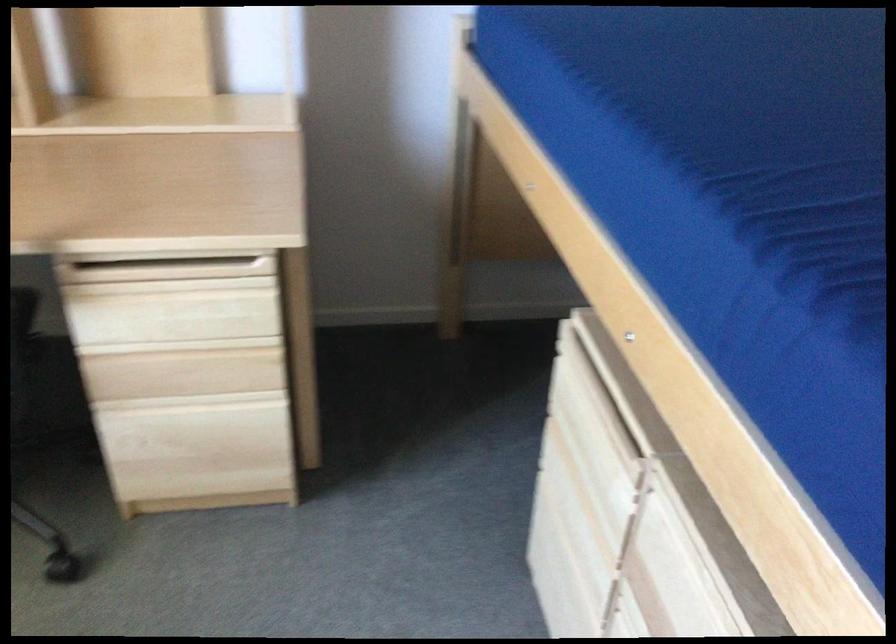
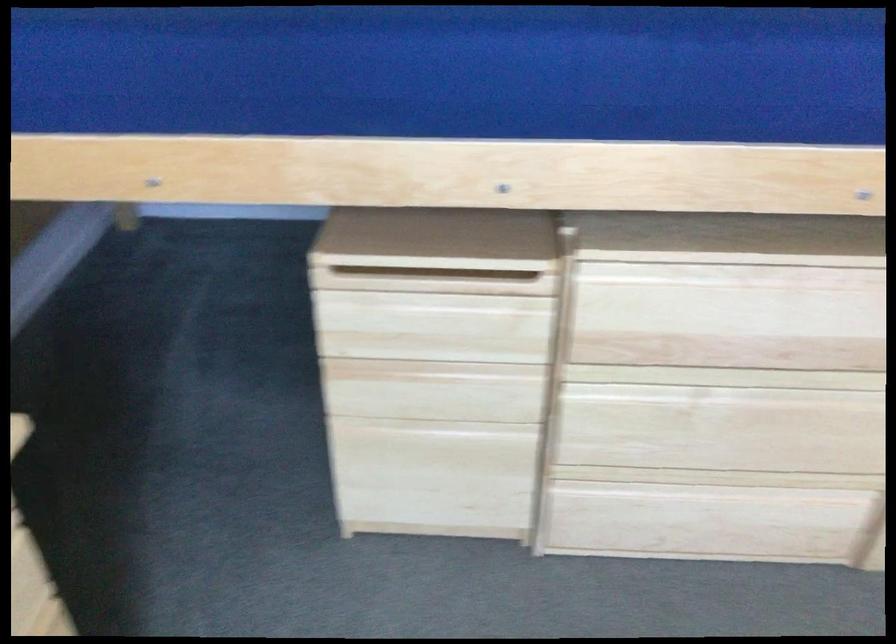
The point at (597,392) is marked in the first image. Where is the corresponding point in the second image?

(432, 279)